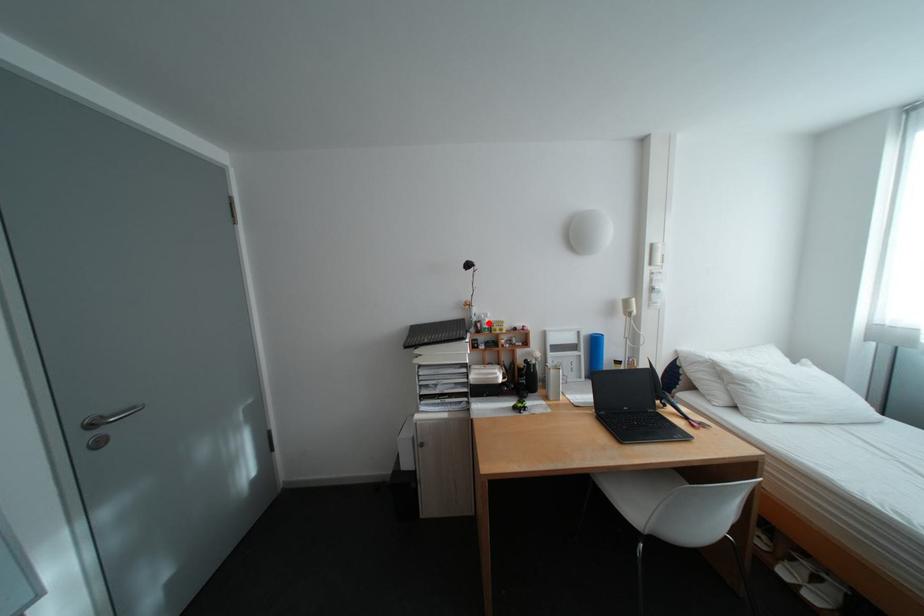
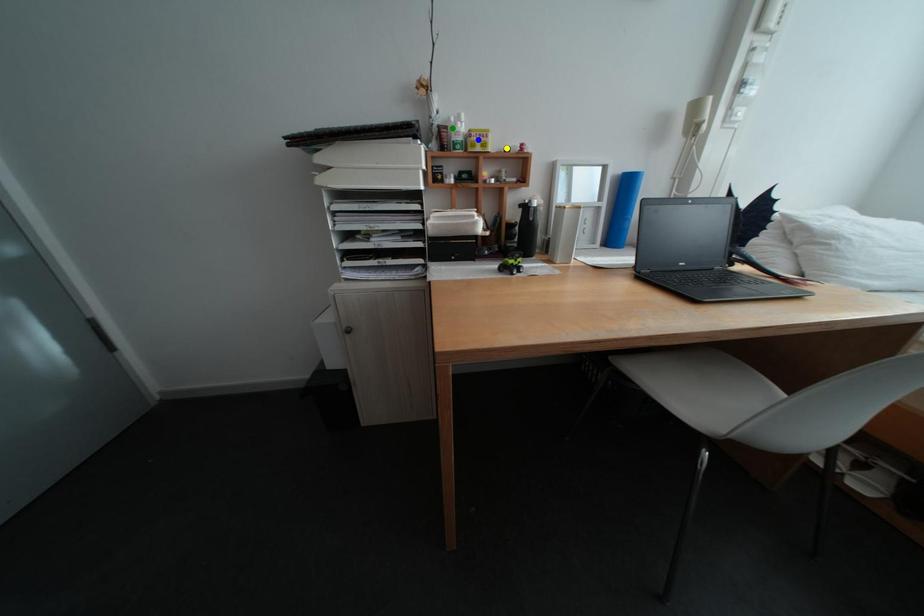
Question: I am providing you with two images of the same scene from different viewpoints. A red point is marked on the first image. You are given multiple points on the second image. Can you choose the point in image 2 that corresponds to the point in image 1?

Choices:
 (A) green point
 (B) yellow point
 (C) blue point

Answer: (A)